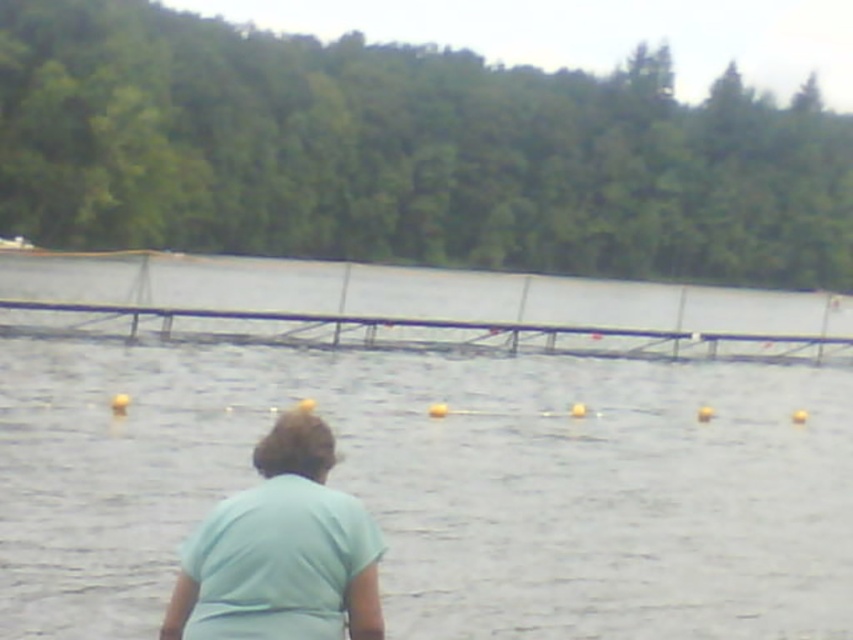
Question: Which of the following is the closest to the observer?

Choices:
 (A) (180, 292)
 (B) (299, 474)

Answer: (B)

Question: Can you confirm if clear water at center is positioned to the left of light blue fabric at center?

Choices:
 (A) yes
 (B) no

Answer: (A)

Question: Considering the relative positions of clear water at center and light blue fabric at center in the image provided, where is clear water at center located with respect to light blue fabric at center?

Choices:
 (A) right
 (B) left

Answer: (B)

Question: Among these objects, which one is nearest to the camera?

Choices:
 (A) clear water at center
 (B) light blue fabric at center

Answer: (B)

Question: Does clear water at center appear under light blue fabric at center?

Choices:
 (A) no
 (B) yes

Answer: (A)